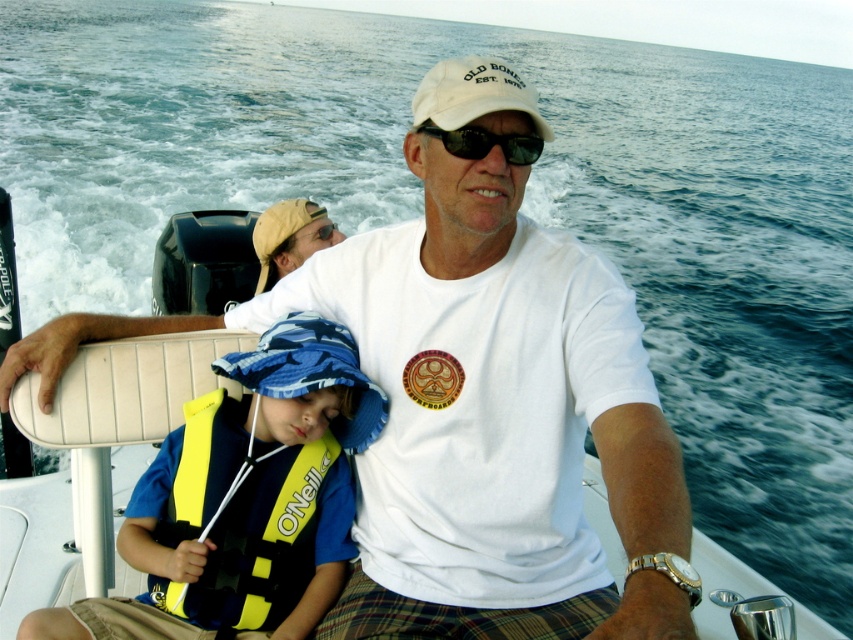
You are a photographer on the boat trying to capture a photo of the yellow life vest at center and the white fabric baseball cap at center. If you want to frame them so that the yellow life vest is on the left side of the photo, is the current arrangement suitable?

The yellow life vest at center is already positioned to the left of the white fabric baseball cap at center, so the current arrangement is suitable for framing the yellow life vest at center on the left side of the photo.

You are a safety inspector checking the boat for proper equipment placement. According to regulations, life vests must be easily accessible and not obstructed by other items. Based on the scene, is the yellow life vest at center positioned correctly relative to the white fabric baseball cap at center?

The yellow life vest at center is in front of the white fabric baseball cap at center, so it is positioned correctly as it is not obstructed and remains accessible.